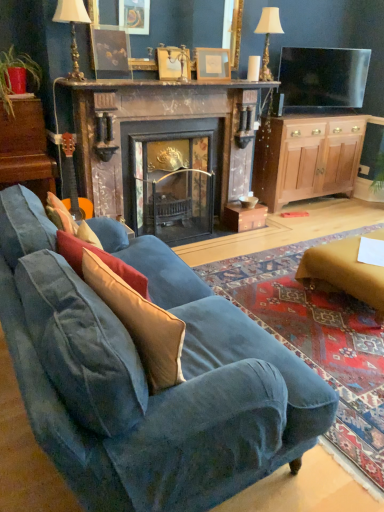
I want to click on blank area to the left of matte gold ottoman at lower right, so click(268, 289).